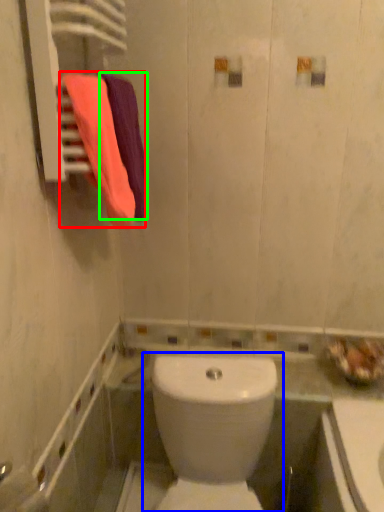
Question: Which object is the closest to the bath towel (highlighted by a red box)? Choose among these: toilet (highlighted by a blue box) or bath towel (highlighted by a green box).

Choices:
 (A) toilet
 (B) bath towel

Answer: (B)